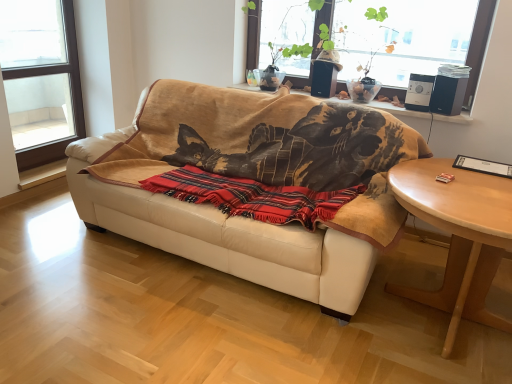
Question: Considering the positions of transparent glass window at upper center, which is the 2th window from left to right, and beige leather couch at center in the image, is transparent glass window at upper center, which is the 2th window from left to right, taller or shorter than beige leather couch at center?

Choices:
 (A) short
 (B) tall

Answer: (A)

Question: Is transparent glass window at upper center, acting as the first window starting from the right, inside the boundaries of beige leather couch at center, or outside?

Choices:
 (A) inside
 (B) outside

Answer: (B)

Question: Estimate the real-world distances between objects in this image. Which object is closer to the beige leather couch at center?

Choices:
 (A) wooden window sill at upper center
 (B) light brown wooden coffee table at lower right
 (C) transparent glass window at upper center, which is the 2th window from left to right
 (D) red plaid blanket at center
 (E) transparent glass window at upper left, which is counted as the 1th window, starting from the left

Answer: (D)

Question: Considering the real-world distances, which object is farthest from the transparent glass window at upper center, which is the 2th window from left to right?

Choices:
 (A) transparent glass window at upper left, which is counted as the 1th window, starting from the left
 (B) beige leather couch at center
 (C) wooden window sill at upper center
 (D) red plaid blanket at center
 (E) light brown wooden coffee table at lower right

Answer: (A)